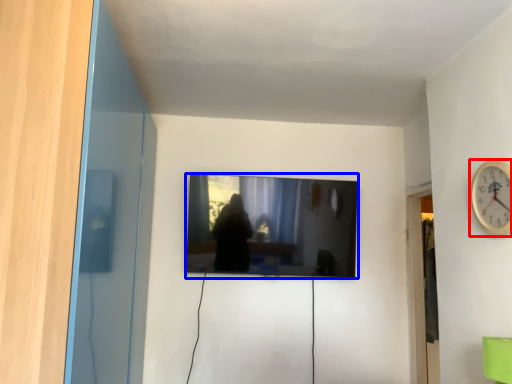
Question: Which point is closer to the camera, wall clock (highlighted by a red box) or television (highlighted by a blue box)?

Choices:
 (A) wall clock
 (B) television

Answer: (A)